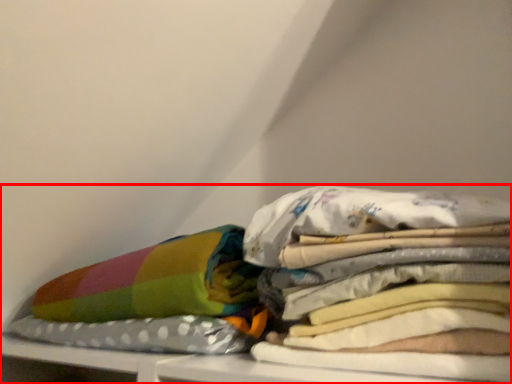
Question: Where is furniture (annotated by the red box) located in relation to material in the image?

Choices:
 (A) right
 (B) left

Answer: (A)